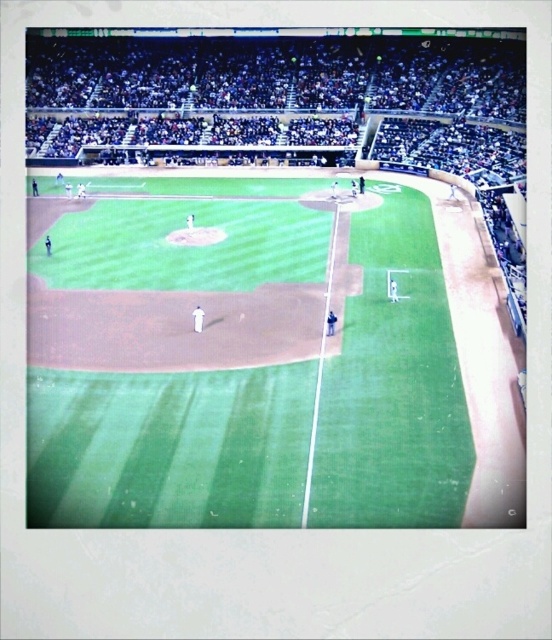
You are a drone operator trying to capture aerial footage of the baseball game. You see the green grass field at center and the green grass baseball field at center in your camera view. Which one appears closer to the camera based on their height in the image?

The green grass field at center appears closer to the camera because it has a lesser height compared to the green grass baseball field at center, indicating it is nearer due to perspective.